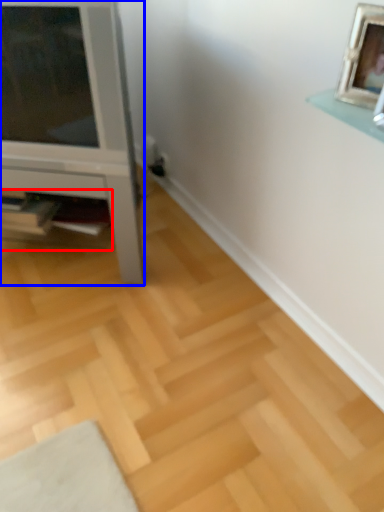
Question: Which object appears closest to the camera in this image, shelf (highlighted by a red box) or furniture (highlighted by a blue box)?

Choices:
 (A) shelf
 (B) furniture

Answer: (B)